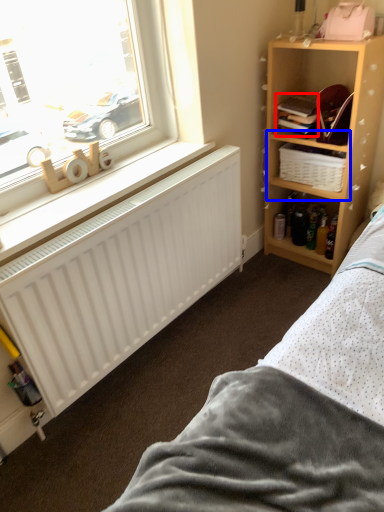
Question: Which point is closer to the camera, book (highlighted by a red box) or cabinet (highlighted by a blue box)?

Choices:
 (A) book
 (B) cabinet

Answer: (A)